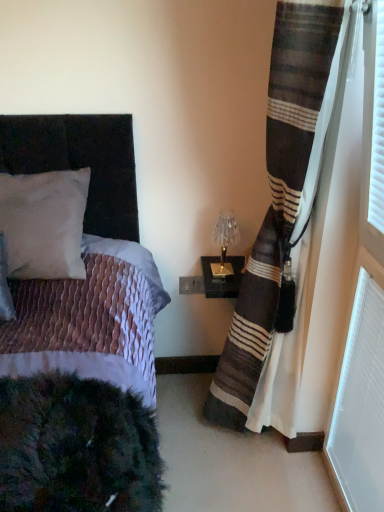
Question: Can you confirm if gold metallic table lamp at upper right is positioned to the left of white matte pillow at upper left?

Choices:
 (A) yes
 (B) no

Answer: (B)

Question: Does gold metallic table lamp at upper right lie in front of white matte pillow at upper left?

Choices:
 (A) no
 (B) yes

Answer: (A)

Question: Can you confirm if gold metallic table lamp at upper right is smaller than white matte pillow at upper left?

Choices:
 (A) yes
 (B) no

Answer: (A)

Question: Is gold metallic table lamp at upper right wider than white matte pillow at upper left?

Choices:
 (A) no
 (B) yes

Answer: (A)

Question: From a real-world perspective, is gold metallic table lamp at upper right below white matte pillow at upper left?

Choices:
 (A) no
 (B) yes

Answer: (B)

Question: From the image's perspective, would you say gold metallic table lamp at upper right is positioned over white matte pillow at upper left?

Choices:
 (A) yes
 (B) no

Answer: (B)

Question: Is white textured radiator at lower right located outside white matte pillow at upper left?

Choices:
 (A) yes
 (B) no

Answer: (A)

Question: Considering the relative sizes of white textured radiator at lower right and white matte pillow at upper left in the image provided, is white textured radiator at lower right bigger than white matte pillow at upper left?

Choices:
 (A) yes
 (B) no

Answer: (B)

Question: Does white textured radiator at lower right have a lesser width compared to white matte pillow at upper left?

Choices:
 (A) yes
 (B) no

Answer: (A)

Question: Is white textured radiator at lower right far away from white matte pillow at upper left?

Choices:
 (A) yes
 (B) no

Answer: (B)

Question: From a real-world perspective, is white textured radiator at lower right physically above white matte pillow at upper left?

Choices:
 (A) no
 (B) yes

Answer: (A)

Question: From a real-world perspective, is white textured radiator at lower right positioned under white matte pillow at upper left based on gravity?

Choices:
 (A) no
 (B) yes

Answer: (B)

Question: Can we say gold metallic table lamp at upper right lies outside velvet black bed at left?

Choices:
 (A) yes
 (B) no

Answer: (A)